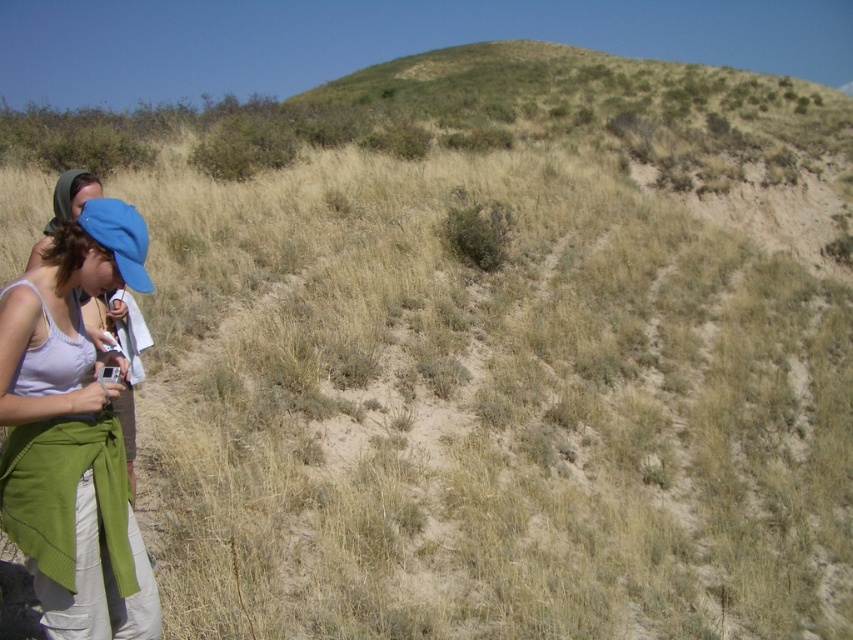
Question: Is matte white tank top at lower left thinner than blue fabric cap at left?

Choices:
 (A) yes
 (B) no

Answer: (B)

Question: Which object is positioned farthest from the blue fabric cap at left?

Choices:
 (A) matte white tank top at lower left
 (B) green knitted scarf at lower left

Answer: (A)

Question: Observing the image, what is the correct spatial positioning of green knitted scarf at lower left in reference to blue fabric cap at left?

Choices:
 (A) left
 (B) right

Answer: (A)

Question: Is matte white tank top at lower left above blue fabric cap at left?

Choices:
 (A) yes
 (B) no

Answer: (B)

Question: Based on their relative distances, which object is nearer to the green knitted scarf at lower left?

Choices:
 (A) matte white tank top at lower left
 (B) blue fabric cap at left

Answer: (A)

Question: Based on their relative distances, which object is farther from the matte white tank top at lower left?

Choices:
 (A) green knitted scarf at lower left
 (B) blue fabric cap at left

Answer: (B)